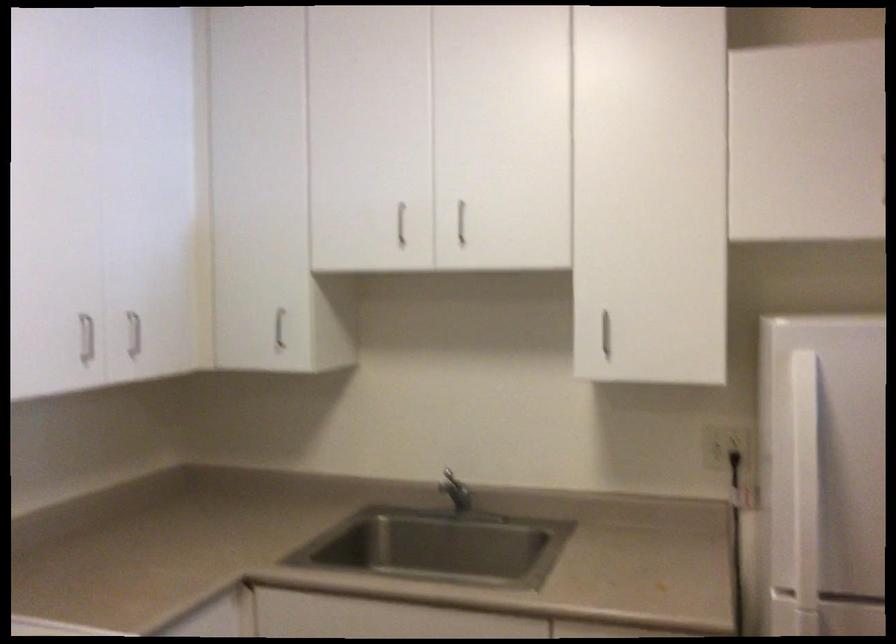
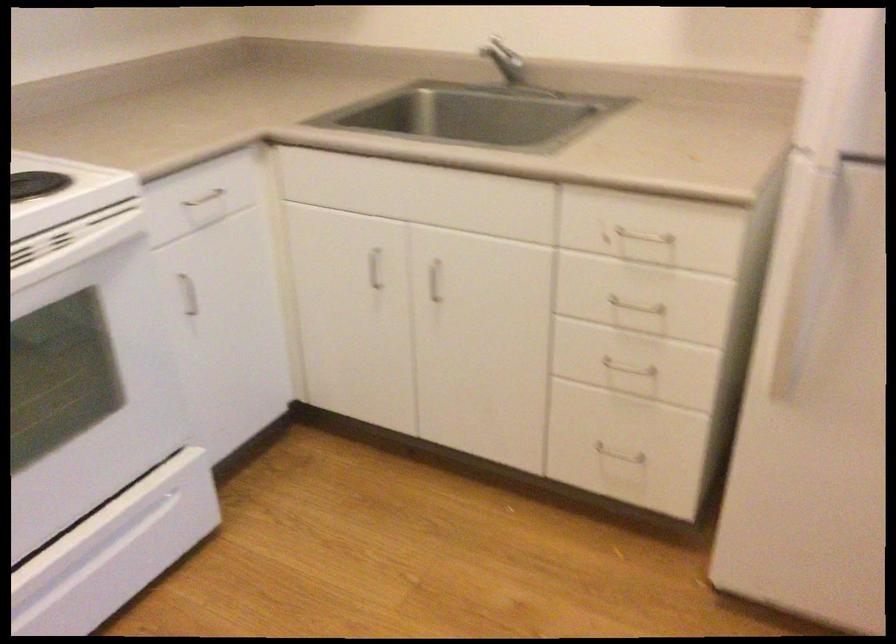
Where in the second image is the point corresponding to pixel 464 496 from the first image?

(510, 68)